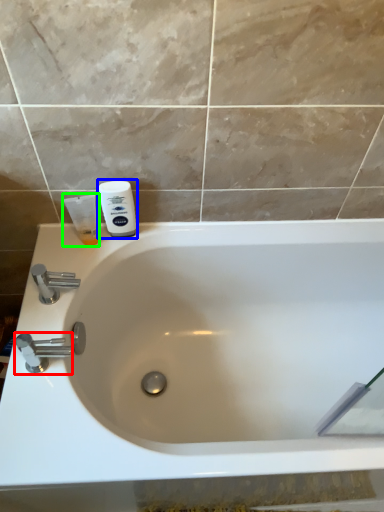
Question: Based on their relative distances, which object is farther from tap (highlighted by a red box)? Choose from shaving cream (highlighted by a blue box) and shaving cream (highlighted by a green box).

Choices:
 (A) shaving cream
 (B) shaving cream

Answer: (A)